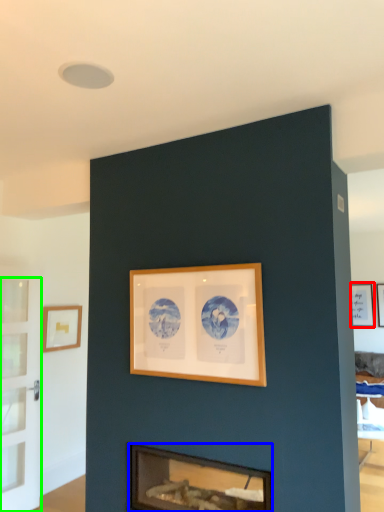
Question: Which object is the farthest from picture frame (highlighted by a red box)? Choose among these: fireplace (highlighted by a blue box) or glass door (highlighted by a green box).

Choices:
 (A) fireplace
 (B) glass door

Answer: (B)